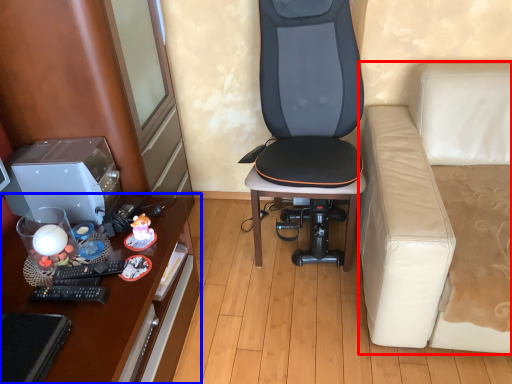
Question: Among these objects, which one is nearest to the camera, studio couch (highlighted by a red box) or desk (highlighted by a blue box)?

Choices:
 (A) studio couch
 (B) desk

Answer: (A)